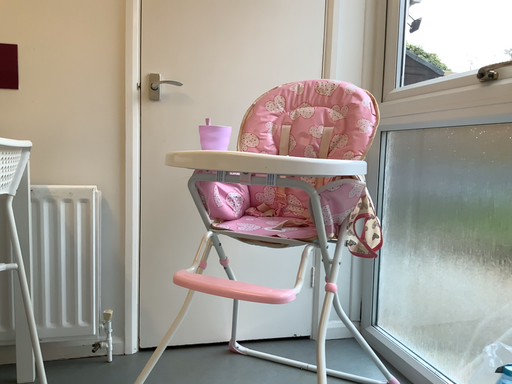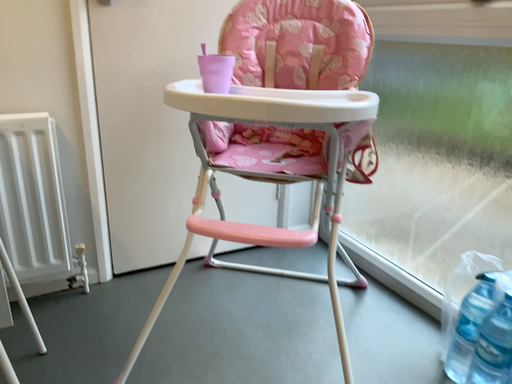
Question: How did the camera likely rotate when shooting the video?

Choices:
 (A) rotated right
 (B) rotated left

Answer: (A)